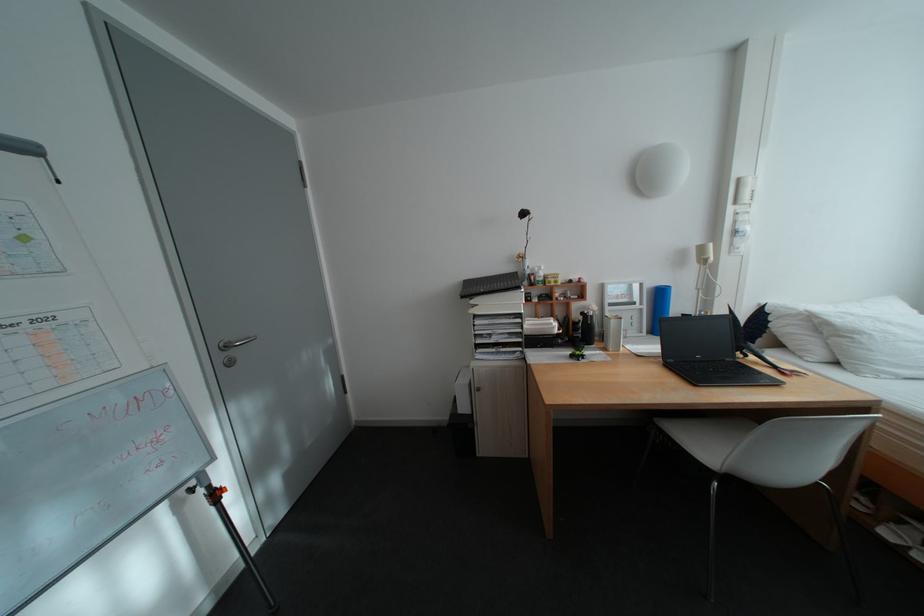
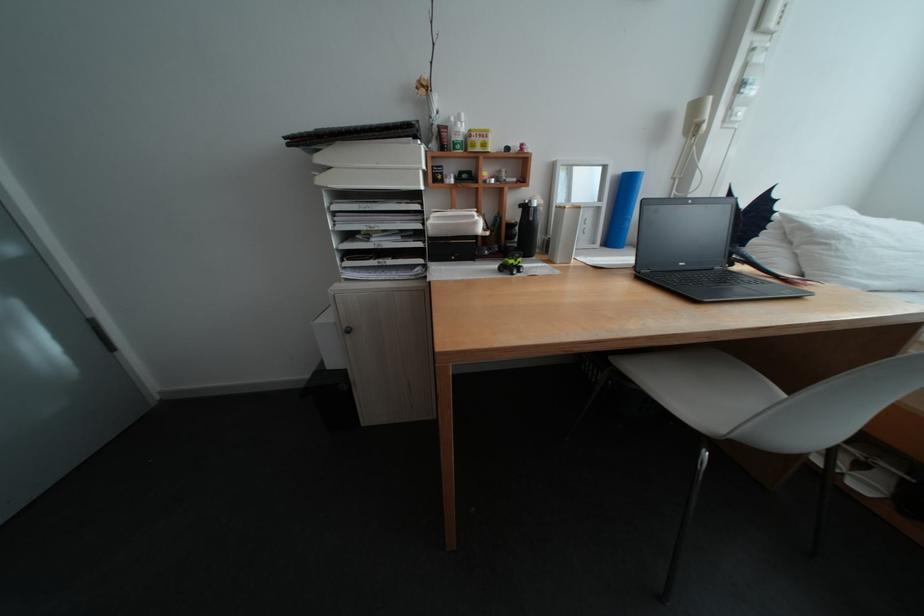
In the second image, find the point that corresponds to (x=485, y=302) in the first image.

(333, 160)